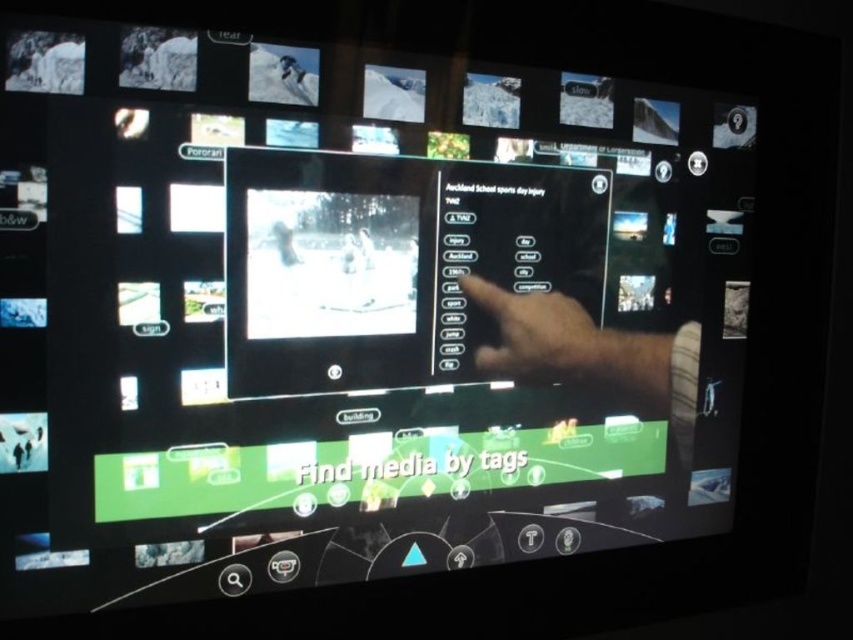
Question: Is skinny hand at center to the right of skinny tan hand at center from the viewer's perspective?

Choices:
 (A) no
 (B) yes

Answer: (B)

Question: Which point appears farthest from the camera in this image?

Choices:
 (A) (677, 388)
 (B) (561, 324)

Answer: (A)

Question: Does skinny hand at center have a larger size compared to skinny tan hand at center?

Choices:
 (A) yes
 (B) no

Answer: (A)

Question: Which of the following is the closest to the observer?

Choices:
 (A) (596, 348)
 (B) (525, 305)

Answer: (B)

Question: Where is skinny hand at center located in relation to skinny tan hand at center in the image?

Choices:
 (A) left
 (B) right

Answer: (B)